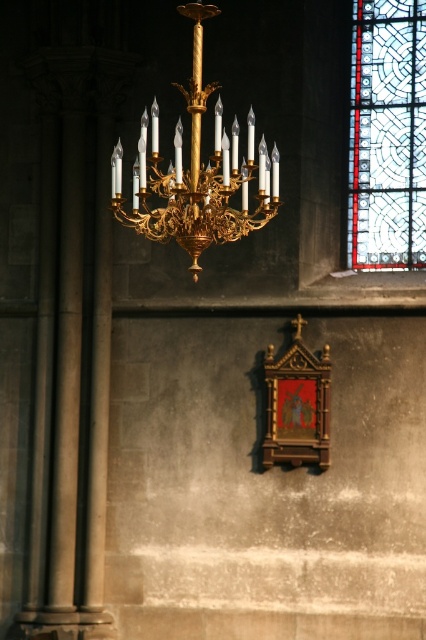
Question: Which object appears closest to the camera in this image?

Choices:
 (A) gold/gilded metal chandelier at upper center
 (B) stained glass window at upper right

Answer: (A)

Question: Can you confirm if stained glass window at upper right is bigger than gold/gilded metal chandelier at upper center?

Choices:
 (A) no
 (B) yes

Answer: (A)

Question: Does stained glass window at upper right have a smaller size compared to gold/gilded metal chandelier at upper center?

Choices:
 (A) no
 (B) yes

Answer: (B)

Question: Which object appears farthest from the camera in this image?

Choices:
 (A) gold/gilded metal chandelier at upper center
 (B) stained glass window at upper right

Answer: (B)

Question: Can you confirm if stained glass window at upper right is positioned to the left of gold/gilded metal chandelier at upper center?

Choices:
 (A) yes
 (B) no

Answer: (B)

Question: Which point is farther to the camera?

Choices:
 (A) (229, 164)
 (B) (376, 196)

Answer: (B)